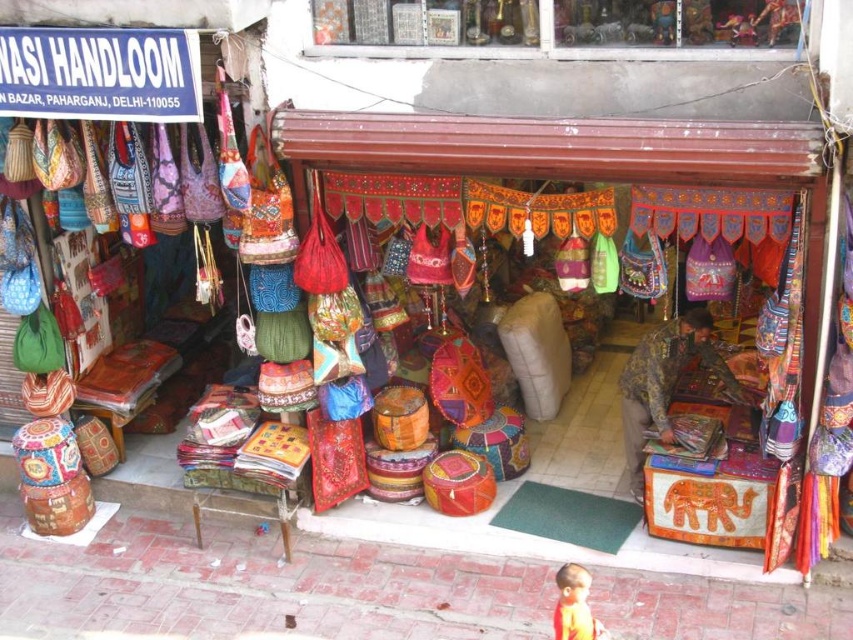
Which is below, camouflage fabric boy at center or orange fabric boy at lower right?

Positioned lower is orange fabric boy at lower right.

Does point (674, 371) come behind point (560, 582)?

Yes, point (674, 371) is farther from viewer.

Is point (730, 394) more distant than point (583, 572)?

That is True.

Where is `camouflage fabric boy at center`? This screenshot has height=640, width=853. camouflage fabric boy at center is located at coordinates (665, 381).